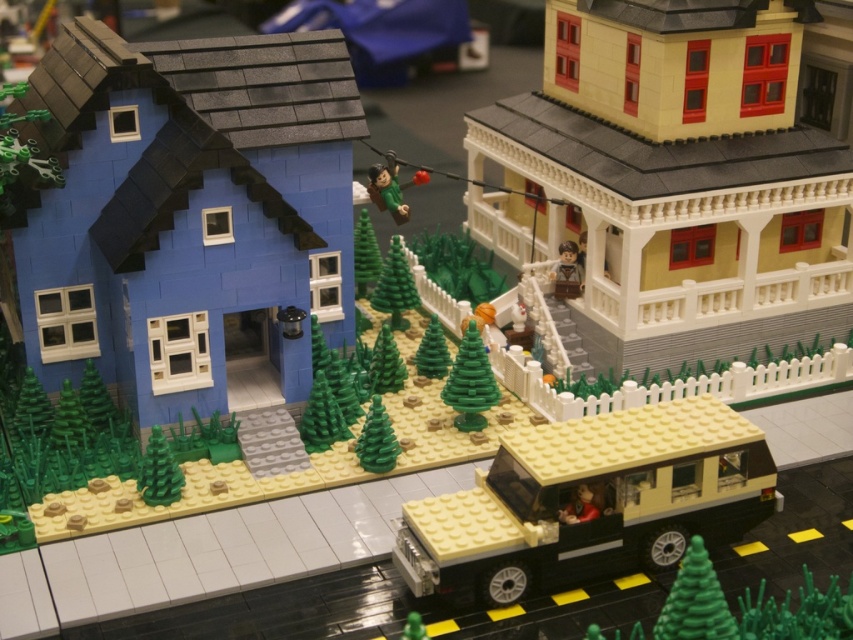
You are a Lego figure standing at the origin point of the diorama. You want to reach the house on the right. Which direction should you move relative to the green matte tree at center?

Since the green matte tree at center is located at point (376, 440), you should move towards the right side of the tree to reach the house on the right.

You are a Lego figure trying to reach the green matte tree at center from the matte yellow plastic car at center. Can you walk directly to the tree without moving any objects?

The distance between the matte yellow plastic car at center and the green matte tree at center is 15.23 inches, so yes, you can walk directly to the tree without moving any objects as the distance is manageable for a Lego figure.

Looking at this image, you are a Lego figure trying to reach the green matte figure at lower center from the green matte tree at center. Can you walk directly to it without moving any objects?

The green matte tree at center is positioned over green matte figure at lower center, so you cannot walk directly to it without moving the tree.